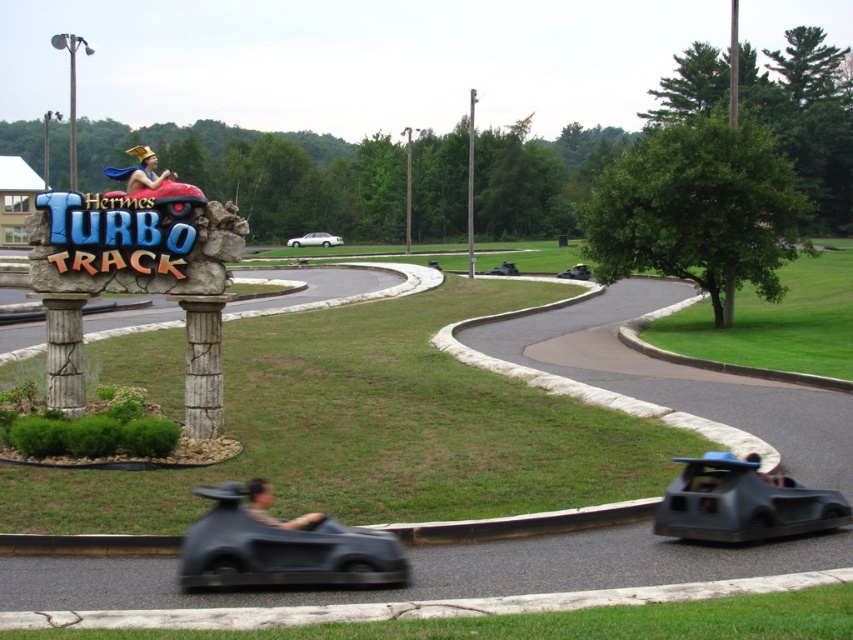
Question: Which point is closer to the camera taking this photo?

Choices:
 (A) [x=322, y=240]
 (B) [x=848, y=504]

Answer: (B)

Question: Does black plastic go-kart at right appear over white glossy sedan at center?

Choices:
 (A) no
 (B) yes

Answer: (A)

Question: Can you confirm if black plastic go-kart at right is thinner than white glossy sedan at center?

Choices:
 (A) no
 (B) yes

Answer: (B)

Question: Which point appears farthest from the camera in this image?

Choices:
 (A) (828, 508)
 (B) (306, 236)

Answer: (B)

Question: Which object is closer to the camera taking this photo?

Choices:
 (A) matte black go-kart at lower center
 (B) white glossy sedan at center

Answer: (A)

Question: Is matte black go-kart at lower center to the left of black plastic go-kart at right from the viewer's perspective?

Choices:
 (A) yes
 (B) no

Answer: (A)